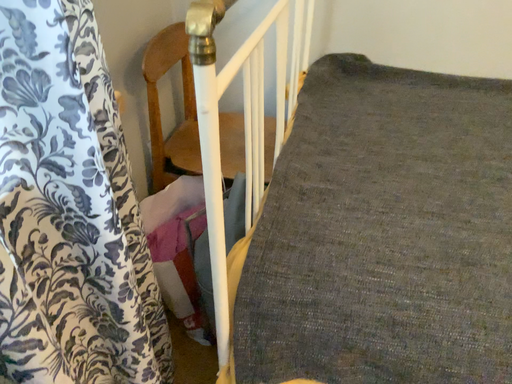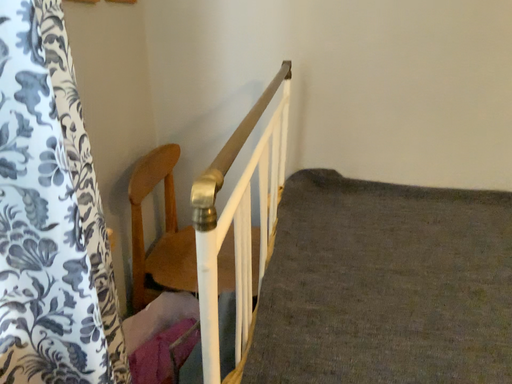
Question: Which way did the camera rotate in the video?

Choices:
 (A) rotated downward
 (B) rotated upward

Answer: (B)